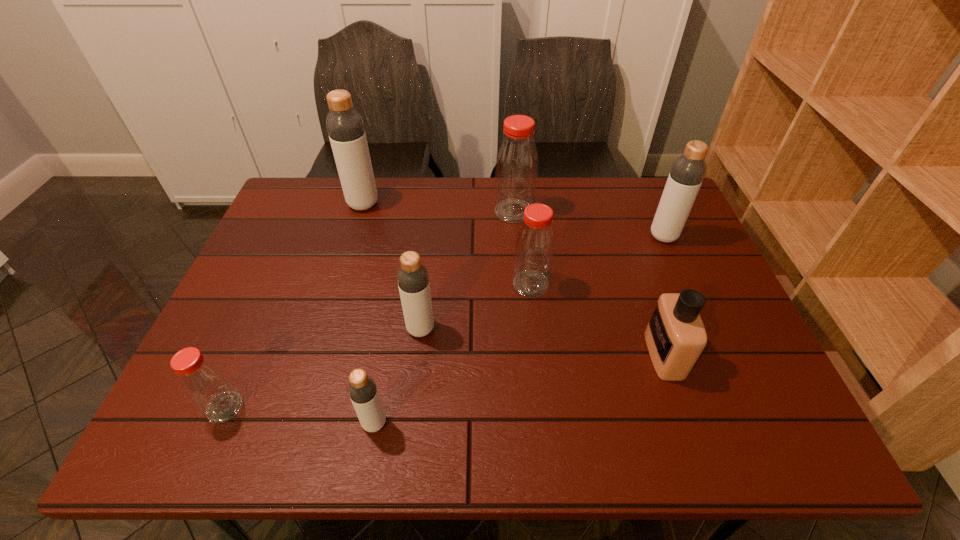
In the image, there is a desktop. At what (x,y) coordinates should I click in order to perform the action: click on free space at the left edge. Please return your answer as a coordinate pair (x, y). The height and width of the screenshot is (540, 960). Looking at the image, I should click on (256, 279).

In the image, there is a desktop. Where is `vacant space at the right edge`? vacant space at the right edge is located at coordinates (711, 283).

Where is `vacant position at the far left corner of the desktop`? The width and height of the screenshot is (960, 540). vacant position at the far left corner of the desktop is located at coordinates (304, 197).

You are a GUI agent. You are given a task and a screenshot of the screen. Output one action in this format:
    pyautogui.click(x=<x>, y=<y>)
    Task: Click on the free space at the far right corner of the desktop
    The image size is (960, 540).
    Given the screenshot: What is the action you would take?
    pyautogui.click(x=643, y=221)

Find the location of `empty space that is in between the leftmost red bottle and the farthest gray bottle`. empty space that is in between the leftmost red bottle and the farthest gray bottle is located at coordinates pos(294,306).

You are a GUI agent. You are given a task and a screenshot of the screen. Output one action in this format:
    pyautogui.click(x=<x>, y=<y>)
    Task: Click on the free point between the leftmost bottle and the biggest red bottle
    This screenshot has width=960, height=540.
    Given the screenshot: What is the action you would take?
    pyautogui.click(x=370, y=309)

Identify the location of unoccupied area between the leftmost gray bottle and the leftmost bottle. The image size is (960, 540). (294, 306).

This screenshot has height=540, width=960. Find the location of `free point between the fourth farthest bottle and the smallest gray bottle`. free point between the fourth farthest bottle and the smallest gray bottle is located at coordinates (452, 354).

You are a GUI agent. You are given a task and a screenshot of the screen. Output one action in this format:
    pyautogui.click(x=<x>, y=<y>)
    Task: Click on the empty location between the smallest gray bottle and the third smallest gray bottle
    Image resolution: width=960 pixels, height=540 pixels.
    Given the screenshot: What is the action you would take?
    coord(519,329)

Where is `free space between the second object from right to left and the second smallest gray bottle`? This screenshot has width=960, height=540. free space between the second object from right to left and the second smallest gray bottle is located at coordinates (542, 342).